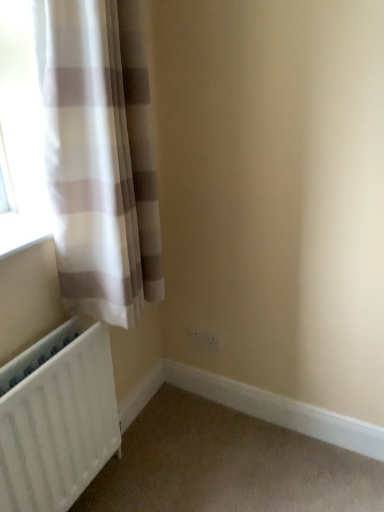
Question: Considering the positions of white sheer curtain at left and white plastic electric outlet at lower center in the image, is white sheer curtain at left bigger or smaller than white plastic electric outlet at lower center?

Choices:
 (A) small
 (B) big

Answer: (B)

Question: From the image's perspective, relative to white plastic electric outlet at lower center, is white sheer curtain at left above or below?

Choices:
 (A) above
 (B) below

Answer: (A)

Question: Which is farther from the white matte radiator at lower left?

Choices:
 (A) white plastic electric outlet at lower center
 (B) white sheer curtain at left

Answer: (A)

Question: Which is farther from the white sheer curtain at left?

Choices:
 (A) white matte radiator at lower left
 (B) white plastic electric outlet at lower center

Answer: (B)